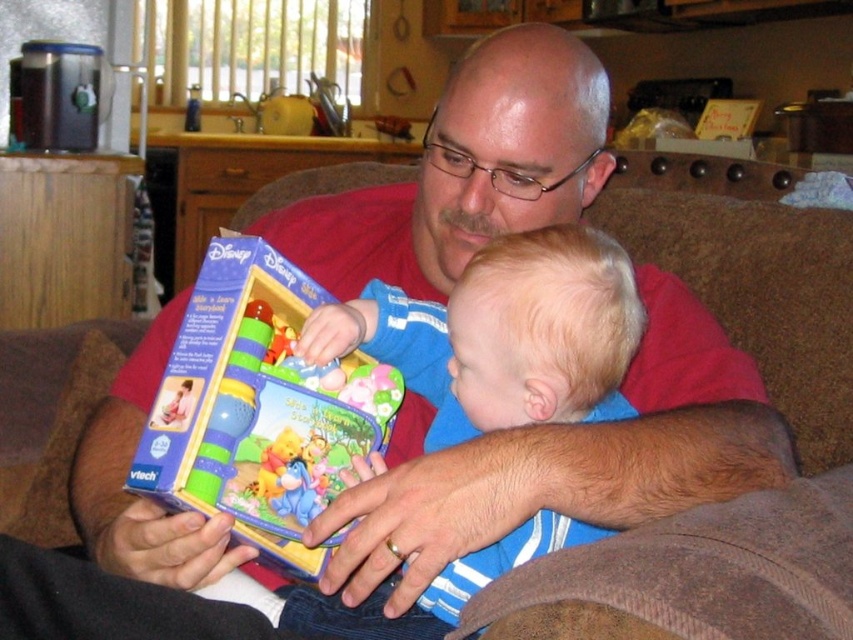
Based on the photo, is blue striped shirt at center below matte plastic toy at center?

Yes, blue striped shirt at center is below matte plastic toy at center.

Between blue striped shirt at center and matte plastic toy at center, which one is positioned higher?

matte plastic toy at center

Is point (579, 260) behind point (286, 289)?

That is False.

What are the coordinates of `blue striped shirt at center` in the screenshot? It's located at (503, 333).